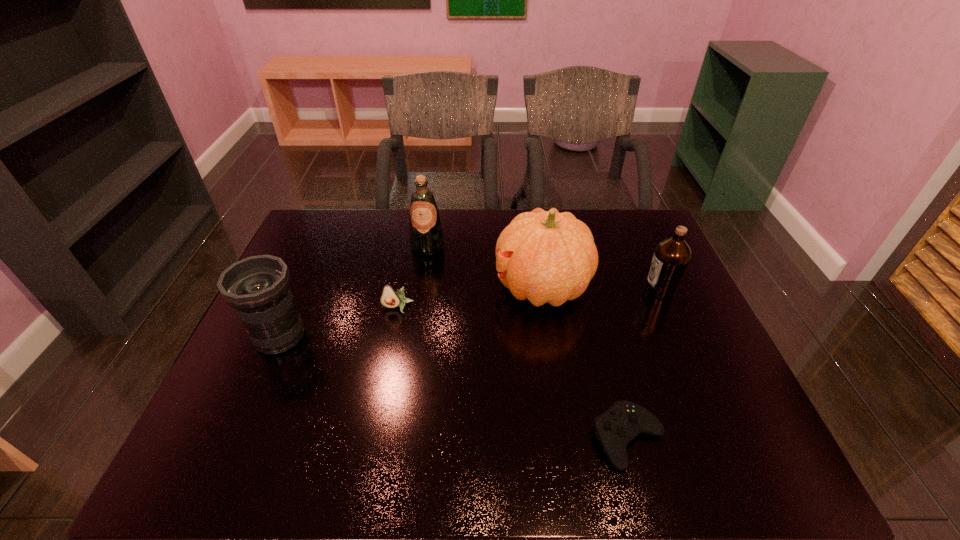
Identify the location of free region located on the carved face of the pumpkin. click(437, 287).

Identify the location of free region located 0.140m on the front-facing side of the left olive oil. (421, 289).

You are a GUI agent. You are given a task and a screenshot of the screen. Output one action in this format:
    pyautogui.click(x=<x>, y=<y>)
    Task: Click on the vacant space located 0.330m on the label of the rightmost object
    This screenshot has width=960, height=540.
    Given the screenshot: What is the action you would take?
    pyautogui.click(x=530, y=290)

This screenshot has height=540, width=960. In order to click on vacant space situated on the label of the rightmost object in this screenshot , I will do `click(595, 290)`.

Locate an element on the screen. The width and height of the screenshot is (960, 540). free space located 0.190m on the label of the rightmost object is located at coordinates (579, 290).

This screenshot has width=960, height=540. I want to click on vacant space situated on the front of the telephoto lens, so click(x=227, y=457).

Where is `free space located on the seed side of the avocado`? The height and width of the screenshot is (540, 960). free space located on the seed side of the avocado is located at coordinates (382, 388).

Locate an element on the screen. This screenshot has height=540, width=960. vacant area situated 0.350m on the back of the nearest object is located at coordinates (591, 298).

I want to click on object located at the far edge, so click(x=426, y=238).

Where is `object that is at the near edge`? The height and width of the screenshot is (540, 960). object that is at the near edge is located at coordinates (624, 420).